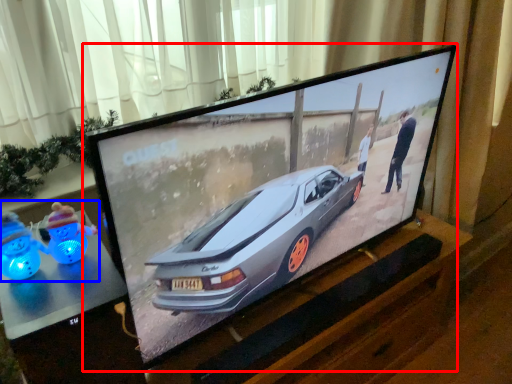
Question: Which object is further to the camera taking this photo, television (highlighted by a red box) or toy (highlighted by a blue box)?

Choices:
 (A) television
 (B) toy

Answer: (B)